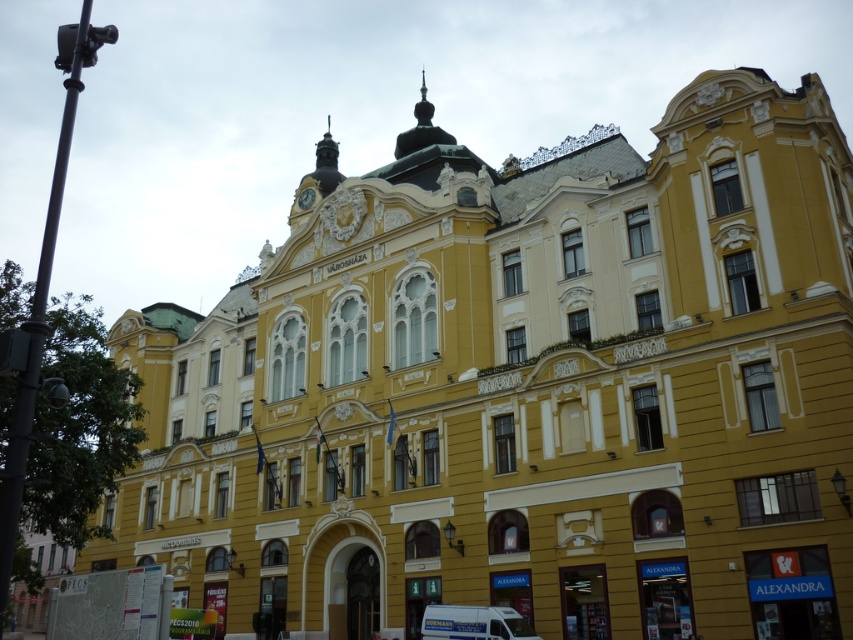
Is white matte van at lower center positioned before gold metallic clock at upper center?

Yes, white matte van at lower center is in front of gold metallic clock at upper center.

Which is in front, point (476, 634) or point (303, 202)?

Point (476, 634) is more forward.

At what (x,y) coordinates should I click in order to perform the action: click on white matte van at lower center. Please return your answer as a coordinate pair (x, y). The height and width of the screenshot is (640, 853). Looking at the image, I should click on (473, 621).